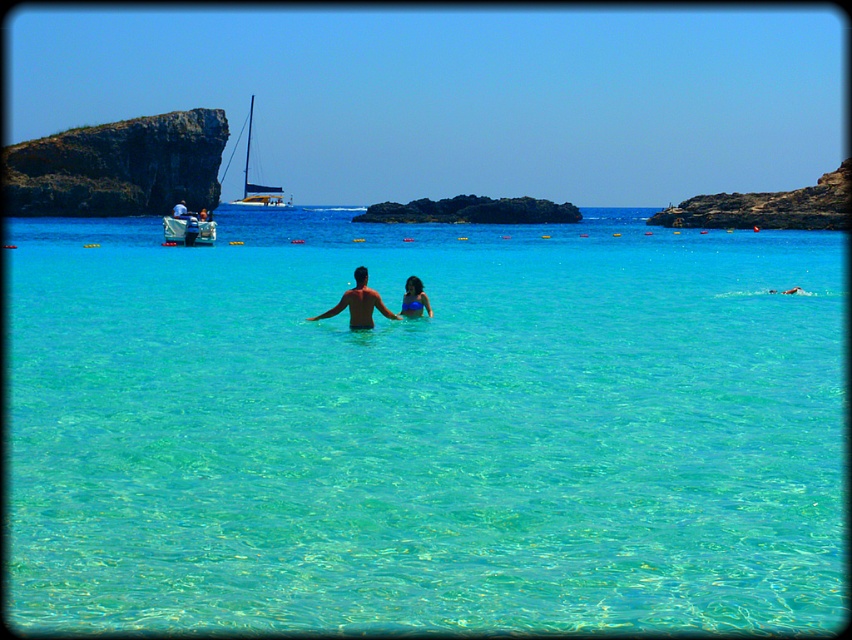
Which of these two, clear water at center or matte skin couple at center, stands shorter?

With less height is matte skin couple at center.

Between clear water at center and matte skin couple at center, which one appears on the right side from the viewer's perspective?

matte skin couple at center is more to the right.

Image resolution: width=852 pixels, height=640 pixels. I want to click on clear water at center, so click(x=426, y=428).

Locate an element on the screen. The image size is (852, 640). clear water at center is located at coordinates (426, 428).

Can you confirm if matte skin couple at center is positioned to the right of blue fabric swimsuit at center?

No, matte skin couple at center is not to the right of blue fabric swimsuit at center.

Does matte skin couple at center appear on the left side of blue fabric swimsuit at center?

Indeed, matte skin couple at center is positioned on the left side of blue fabric swimsuit at center.

Image resolution: width=852 pixels, height=640 pixels. In order to click on matte skin couple at center in this screenshot , I will do [376, 301].

How much distance is there between white sailboat at upper left and blue fabric swimsuit at center?

white sailboat at upper left and blue fabric swimsuit at center are 170.24 meters apart from each other.

Between point (263, 196) and point (424, 308), which one is positioned behind?

Positioned behind is point (263, 196).

You are a GUI agent. You are given a task and a screenshot of the screen. Output one action in this format:
    pyautogui.click(x=<x>, y=<y>)
    Task: Click on the white sailboat at upper left
    The image size is (852, 640).
    Given the screenshot: What is the action you would take?
    pyautogui.click(x=258, y=184)